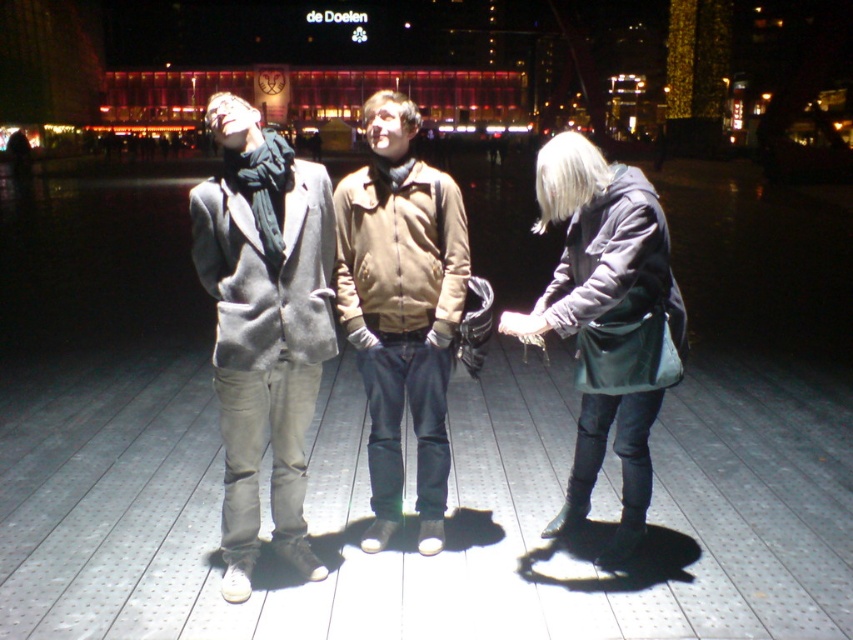
Which of these two, beige fabric jacket at center or matte black jacket at right, stands taller?

beige fabric jacket at center is taller.

Does beige fabric jacket at center come behind matte black jacket at right?

Yes, beige fabric jacket at center is behind matte black jacket at right.

Is point (351, 276) less distant than point (662, 273)?

That is False.

Locate an element on the screen. Image resolution: width=853 pixels, height=640 pixels. beige fabric jacket at center is located at coordinates (401, 308).

Which of these two, gray woolen coat at center or matte black jacket at right, stands taller?

Standing taller between the two is gray woolen coat at center.

What do you see at coordinates (264, 324) in the screenshot?
I see `gray woolen coat at center` at bounding box center [264, 324].

I want to click on gray woolen coat at center, so click(x=264, y=324).

Does matte gray coat at center have a lesser width compared to beige fabric jacket at center?

In fact, matte gray coat at center might be wider than beige fabric jacket at center.

Is matte gray coat at center closer to the viewer compared to beige fabric jacket at center?

Yes, it is in front of beige fabric jacket at center.

Is point (340, 307) more distant than point (375, 460)?

No, it is in front of (375, 460).

I want to click on matte gray coat at center, so click(x=328, y=317).